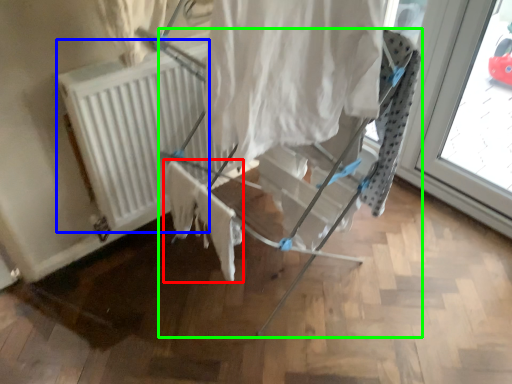
Question: Which is farther away from fabric (highlighted by a red box)? radiator (highlighted by a blue box) or furniture (highlighted by a green box)?

Choices:
 (A) radiator
 (B) furniture

Answer: (A)